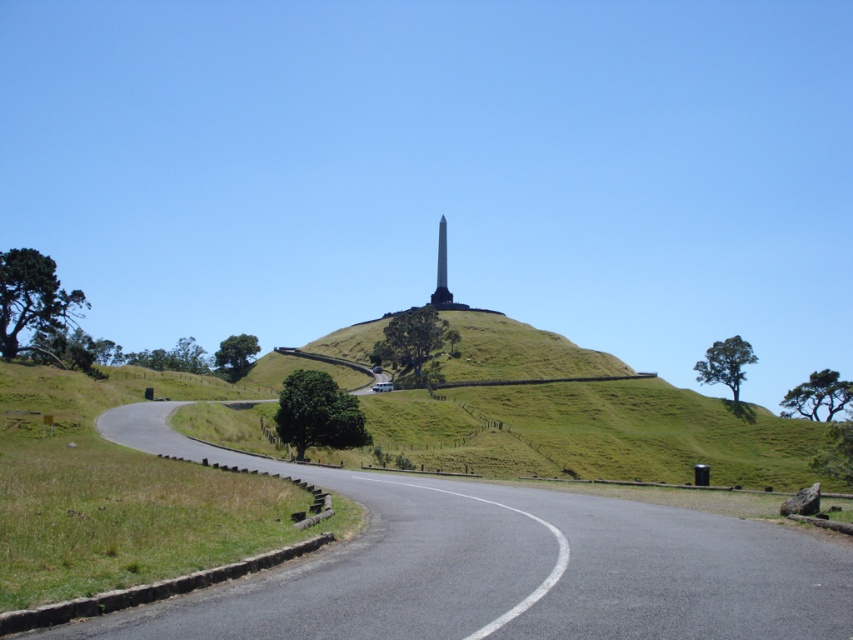
Question: Does green grass at lower left have a greater width compared to black polished obelisk at center?

Choices:
 (A) no
 (B) yes

Answer: (B)

Question: Among these objects, which one is nearest to the camera?

Choices:
 (A) black polished obelisk at center
 (B) green grass at lower left

Answer: (B)

Question: Which point is farther to the camera?

Choices:
 (A) (73, 557)
 (B) (437, 268)

Answer: (B)

Question: Among these points, which one is nearest to the camera?

Choices:
 (A) (227, 416)
 (B) (439, 266)

Answer: (A)

Question: Is green grass at lower left positioned before black polished obelisk at center?

Choices:
 (A) yes
 (B) no

Answer: (A)

Question: Is the position of green grass at lower left more distant than that of black polished obelisk at center?

Choices:
 (A) yes
 (B) no

Answer: (B)